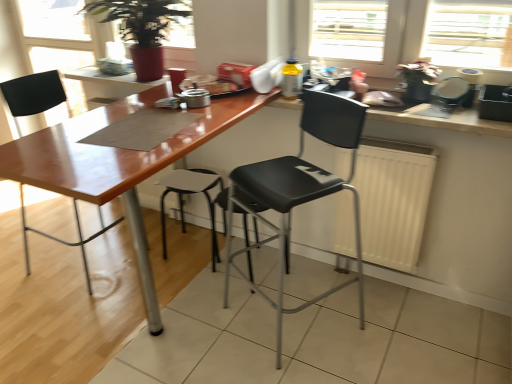
Question: From the image's perspective, is wooden countertop at upper right above or below matte black chair at left, which is the second chair from right to left?

Choices:
 (A) below
 (B) above

Answer: (B)

Question: Is wooden countertop at upper right in front of or behind matte black chair at left, which is the second chair from right to left, in the image?

Choices:
 (A) behind
 (B) front

Answer: (B)

Question: Which of these objects is positioned farthest from the black plastic chair at center, which is the second chair from left to right?

Choices:
 (A) white matte radiator at center
 (B) wooden countertop at upper right
 (C) matte wood table at center, which is the first table in top-to-bottom order
 (D) matte wood table at center, the 2th table viewed from the top
 (E) matte black chair at left, which is the 1th chair from left to right

Answer: (E)

Question: Which is farther from the matte black chair at left, which is the second chair from right to left?

Choices:
 (A) matte wood table at center, the 2th table positioned from the bottom
 (B) matte black stool at center
 (C) white matte radiator at center
 (D) wooden countertop at upper right
 (E) matte wood table at center, the first table ordered from the bottom

Answer: (D)